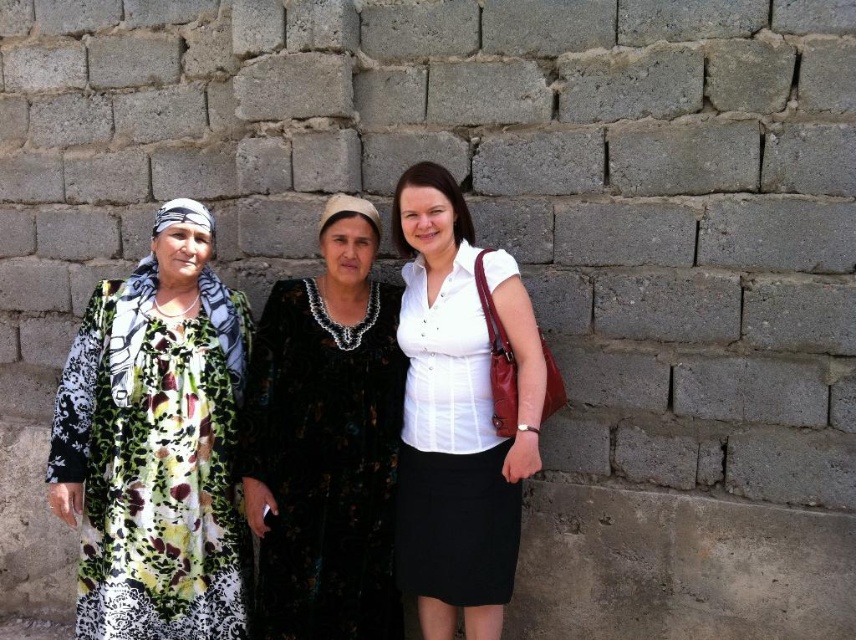
Question: Estimate the real-world distances between objects in this image. Which object is farther from the black floral dress at center?

Choices:
 (A) white matte shirt at center
 (B) floral-patterned dress at left

Answer: (B)

Question: Which object is the farthest from the white matte shirt at center?

Choices:
 (A) black floral dress at center
 (B) floral-patterned dress at left

Answer: (B)

Question: Does floral-patterned dress at left appear under black floral dress at center?

Choices:
 (A) no
 (B) yes

Answer: (B)

Question: Is floral-patterned dress at left below black floral dress at center?

Choices:
 (A) no
 (B) yes

Answer: (B)

Question: Which object is positioned farthest from the floral-patterned dress at left?

Choices:
 (A) white matte shirt at center
 (B) black floral dress at center

Answer: (A)

Question: Does floral-patterned dress at left appear over white matte shirt at center?

Choices:
 (A) no
 (B) yes

Answer: (A)